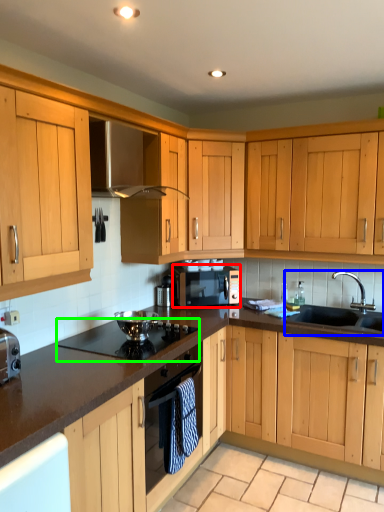
Question: Which object is the farthest from microwave oven (highlighted by a red box)? Choose among these: sink (highlighted by a blue box) or gas stove (highlighted by a green box).

Choices:
 (A) sink
 (B) gas stove

Answer: (A)